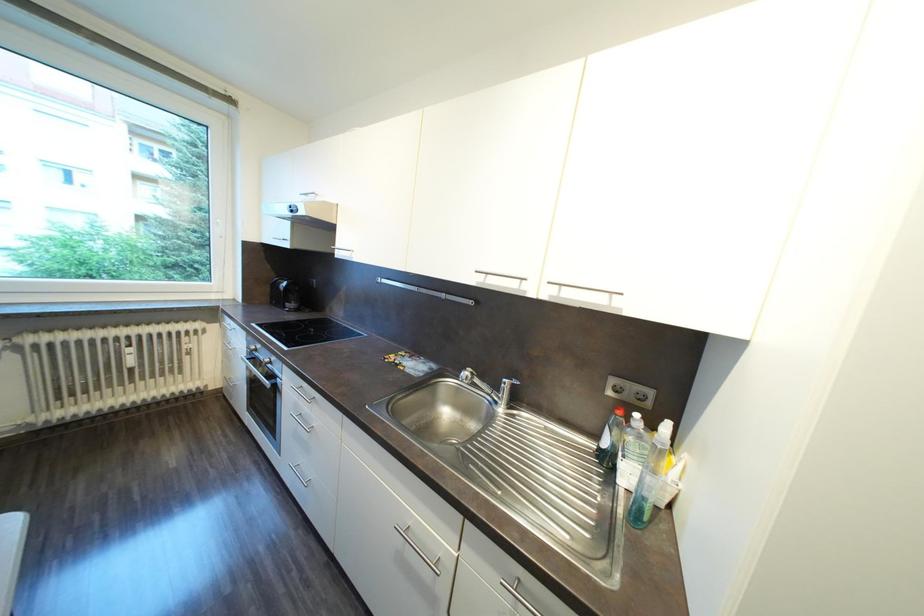
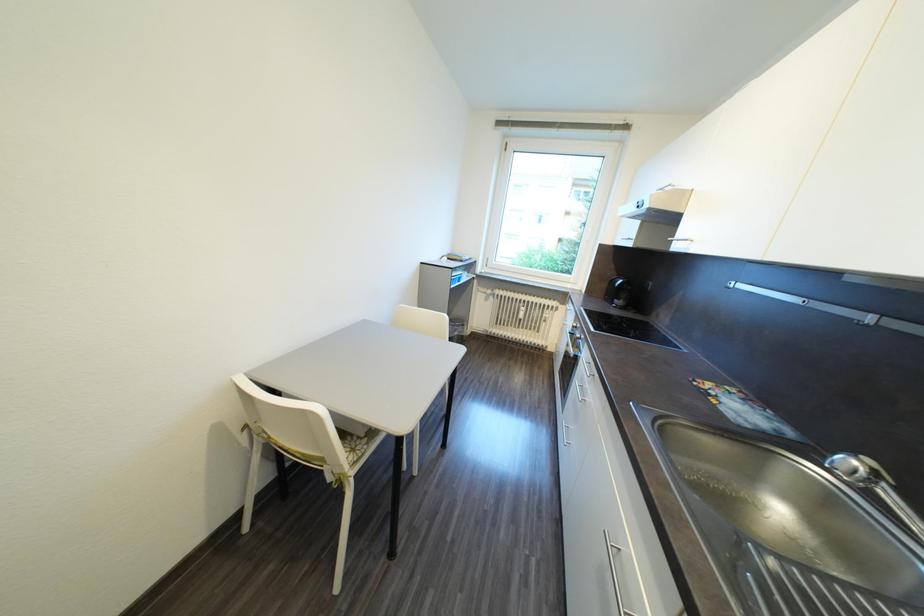
Question: Based on the continuous images, in which direction is the camera rotating? Reply with the corresponding letter.

Choices:
 (A) Left
 (B) Right
 (C) Up
 (D) Down

Answer: (A)